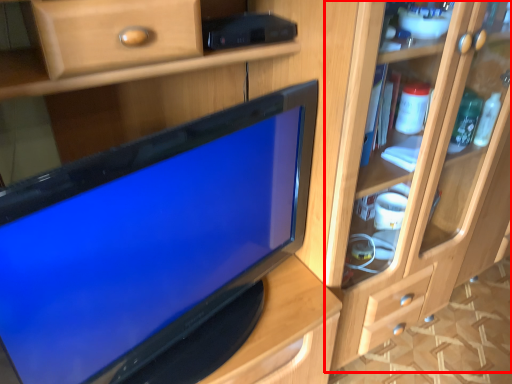
Question: From the image's perspective, considering the relative positions of dresser (annotated by the red box) and television in the image provided, where is dresser (annotated by the red box) located with respect to the staircase?

Choices:
 (A) above
 (B) below

Answer: (A)